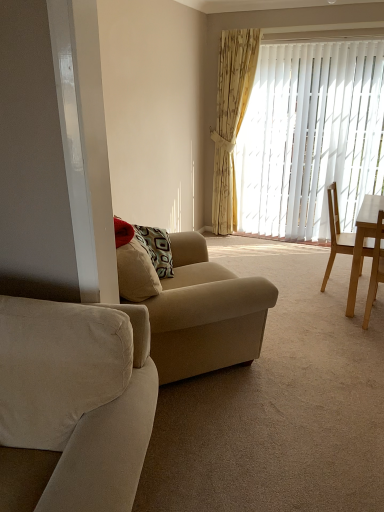
This screenshot has width=384, height=512. I want to click on light brown wooden chair at right, placed as the 2th chair when sorted from front to back, so click(336, 233).

The width and height of the screenshot is (384, 512). What do you see at coordinates (205, 314) in the screenshot? I see `beige fabric couch at center, acting as the first studio couch starting from the back` at bounding box center [205, 314].

Based on the photo, how much space does suede beige couch at left, positioned as the 1th studio couch in front-to-back order, occupy vertically?

suede beige couch at left, positioned as the 1th studio couch in front-to-back order, is 33.98 inches in height.

This screenshot has height=512, width=384. What do you see at coordinates (79, 397) in the screenshot? I see `suede beige couch at left, positioned as the 1th studio couch in front-to-back order` at bounding box center [79, 397].

Image resolution: width=384 pixels, height=512 pixels. What are the coordinates of `white vertical blinds at center` in the screenshot? It's located at (310, 137).

Is beige fabric couch at center, acting as the first studio couch starting from the back, smaller than yellow floral fabric curtain at upper right?

No.

Considering the sizes of objects beige fabric couch at center, acting as the first studio couch starting from the back, and yellow floral fabric curtain at upper right in the image provided, who is thinner, beige fabric couch at center, acting as the first studio couch starting from the back, or yellow floral fabric curtain at upper right?

Thinner between the two is yellow floral fabric curtain at upper right.

Which object is more forward, beige fabric couch at center, placed as the 2th studio couch when sorted from front to back, or yellow floral fabric curtain at upper right?

beige fabric couch at center, placed as the 2th studio couch when sorted from front to back, is more forward.

You are a GUI agent. You are given a task and a screenshot of the screen. Output one action in this format:
    pyautogui.click(x=<x>, y=<y>)
    Task: Click on the 2nd studio couch below the yellow floral fabric curtain at upper right (from a real-world perspective)
    The width and height of the screenshot is (384, 512).
    Given the screenshot: What is the action you would take?
    pyautogui.click(x=205, y=314)

Is the depth of light wood desk at right less than that of beige fabric couch at center, placed as the 2th studio couch when sorted from front to back?

No, the depth of light wood desk at right is greater than that of beige fabric couch at center, placed as the 2th studio couch when sorted from front to back.

Is light wood desk at right far away from beige fabric couch at center, placed as the 2th studio couch when sorted from front to back?

Yes.

Between point (370, 222) and point (160, 332), which one is positioned in front?

The point (160, 332) is closer to the camera.

Is light wood desk at right at the left side of beige fabric couch at center, acting as the first studio couch starting from the back?

No, light wood desk at right is not to the left of beige fabric couch at center, acting as the first studio couch starting from the back.

Is suede beige couch at left, positioned as the 1th studio couch in front-to-back order, located within beige fabric couch at center, placed as the 2th studio couch when sorted from front to back?

No, suede beige couch at left, positioned as the 1th studio couch in front-to-back order, is located outside of beige fabric couch at center, placed as the 2th studio couch when sorted from front to back.

Is beige fabric couch at center, placed as the 2th studio couch when sorted from front to back, wider than suede beige couch at left, positioned as the 1th studio couch in front-to-back order?

In fact, beige fabric couch at center, placed as the 2th studio couch when sorted from front to back, might be narrower than suede beige couch at left, positioned as the 1th studio couch in front-to-back order.

Can you tell me how much beige fabric couch at center, placed as the 2th studio couch when sorted from front to back, and suede beige couch at left, positioned as the 1th studio couch in front-to-back order, differ in facing direction?

116 degrees.

Is point (227, 315) closer or farther from the camera than point (137, 392)?

Point (227, 315) appears to be farther away from the viewer than point (137, 392).

Is yellow floral fabric curtain at upper right facing towards light brown wooden chair at right, placed as the 2th chair when sorted from front to back?

No.

Considering the relative sizes of yellow floral fabric curtain at upper right and light brown wooden chair at right, which is counted as the first chair, starting from the back, in the image provided, is yellow floral fabric curtain at upper right wider than light brown wooden chair at right, which is counted as the first chair, starting from the back,?

Incorrect, the width of yellow floral fabric curtain at upper right does not surpass that of light brown wooden chair at right, which is counted as the first chair, starting from the back.

From a real-world perspective, between yellow floral fabric curtain at upper right and light brown wooden chair at right, placed as the 2th chair when sorted from front to back, who is vertically higher?

In real-world perspective, yellow floral fabric curtain at upper right is above.

Considering the relative sizes of yellow floral fabric curtain at upper right and light brown wooden chair at right, placed as the 2th chair when sorted from front to back, in the image provided, is yellow floral fabric curtain at upper right smaller than light brown wooden chair at right, placed as the 2th chair when sorted from front to back,?

No.

Is beige fabric couch at center, placed as the 2th studio couch when sorted from front to back, shorter than light brown wooden chair at right, which is the first chair in front-to-back order?

In fact, beige fabric couch at center, placed as the 2th studio couch when sorted from front to back, may be taller than light brown wooden chair at right, which is the first chair in front-to-back order.

The image size is (384, 512). I want to click on studio couch that is the 1st one when counting forward from the light brown wooden chair at right, which is the first chair in front-to-back order, so click(205, 314).

From a real-world perspective, who is located higher, beige fabric couch at center, placed as the 2th studio couch when sorted from front to back, or light brown wooden chair at right, which is the first chair in front-to-back order?

From a 3D spatial view, beige fabric couch at center, placed as the 2th studio couch when sorted from front to back, is above.

Would you consider suede beige couch at left, positioned as the 1th studio couch in front-to-back order, to be distant from white vertical blinds at center?

Yes, suede beige couch at left, positioned as the 1th studio couch in front-to-back order, and white vertical blinds at center are located far from each other.

Could you measure the distance between suede beige couch at left, which is the 2th studio couch from back to front, and white vertical blinds at center?

suede beige couch at left, which is the 2th studio couch from back to front, is 11.41 feet from white vertical blinds at center.

Considering the sizes of objects suede beige couch at left, which is the 2th studio couch from back to front, and white vertical blinds at center in the image provided, who is taller, suede beige couch at left, which is the 2th studio couch from back to front, or white vertical blinds at center?

white vertical blinds at center is taller.

Which is more to the right, light wood desk at right or suede beige couch at left, positioned as the 1th studio couch in front-to-back order?

From the viewer's perspective, light wood desk at right appears more on the right side.

Which point is more forward, (373, 200) or (150, 426)?

Positioned in front is point (150, 426).

Is the depth of light wood desk at right greater than that of suede beige couch at left, positioned as the 1th studio couch in front-to-back order?

Yes, it is.

Looking at their sizes, would you say light wood desk at right is wider or thinner than suede beige couch at left, which is the 2th studio couch from back to front?

Clearly, light wood desk at right has less width compared to suede beige couch at left, which is the 2th studio couch from back to front.

The width and height of the screenshot is (384, 512). I want to click on curtain on the right of beige fabric couch at center, acting as the first studio couch starting from the back, so click(x=231, y=119).

What are the coordinates of `the 1st studio couch below the light wood desk at right (from the image's perspective)` in the screenshot? It's located at (205, 314).

Based on the photo, looking at the image, which one is located further to yellow floral fabric curtain at upper right, beige fabric couch at center, acting as the first studio couch starting from the back, or suede beige couch at left, which is the 2th studio couch from back to front?

suede beige couch at left, which is the 2th studio couch from back to front, is further to yellow floral fabric curtain at upper right.

From the image, which object appears to be nearer to light brown wooden chair at right, acting as the 2th chair starting from the back, white vertical blinds at center or light wood desk at right?

light wood desk at right.

When comparing their distances from white vertical blinds at center, does light brown wooden chair at right, placed as the 2th chair when sorted from front to back, or beige fabric couch at center, acting as the first studio couch starting from the back, seem further?

beige fabric couch at center, acting as the first studio couch starting from the back, lies further to white vertical blinds at center than the other object.

When comparing their distances from beige fabric couch at center, placed as the 2th studio couch when sorted from front to back, does light wood desk at right or yellow floral fabric curtain at upper right seem further?

yellow floral fabric curtain at upper right lies further to beige fabric couch at center, placed as the 2th studio couch when sorted from front to back, than the other object.

Looking at the image, which one is located further to white vertical blinds at center, light wood desk at right or suede beige couch at left, which is the 2th studio couch from back to front?

suede beige couch at left, which is the 2th studio couch from back to front.

Considering their positions, is white vertical blinds at center positioned further to suede beige couch at left, positioned as the 1th studio couch in front-to-back order, than beige fabric couch at center, acting as the first studio couch starting from the back?

Among the two, white vertical blinds at center is located further to suede beige couch at left, positioned as the 1th studio couch in front-to-back order.

From the image, which object appears to be nearer to light brown wooden chair at right, which is the first chair in front-to-back order, yellow floral fabric curtain at upper right or beige fabric couch at center, acting as the first studio couch starting from the back?

beige fabric couch at center, acting as the first studio couch starting from the back.

Looking at the image, which one is located further to light brown wooden chair at right, placed as the 2th chair when sorted from front to back, suede beige couch at left, positioned as the 1th studio couch in front-to-back order, or yellow floral fabric curtain at upper right?

suede beige couch at left, positioned as the 1th studio couch in front-to-back order, is positioned further to the anchor light brown wooden chair at right, placed as the 2th chair when sorted from front to back.

What are the coordinates of `window blind between yellow floral fabric curtain at upper right and light wood desk at right in the up-down direction` in the screenshot? It's located at (310, 137).

Locate an element on the screen. The height and width of the screenshot is (512, 384). window blind between beige fabric couch at center, acting as the first studio couch starting from the back, and yellow floral fabric curtain at upper right from front to back is located at coordinates (310, 137).

Find the location of `desk positioned between suede beige couch at left, which is the 2th studio couch from back to front, and light brown wooden chair at right, placed as the 2th chair when sorted from front to back, from near to far`. desk positioned between suede beige couch at left, which is the 2th studio couch from back to front, and light brown wooden chair at right, placed as the 2th chair when sorted from front to back, from near to far is located at coordinates (362, 243).

The image size is (384, 512). I want to click on chair positioned between suede beige couch at left, positioned as the 1th studio couch in front-to-back order, and light brown wooden chair at right, which is counted as the first chair, starting from the back, from near to far, so [x=375, y=269].